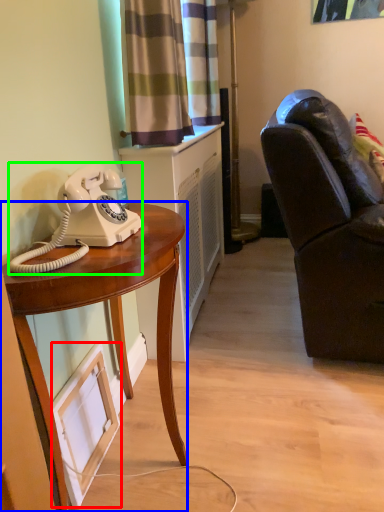
Question: Based on their relative distances, which object is nearer to picture frame (highlighted by a red box)? Choose from desk (highlighted by a blue box) and corded phone (highlighted by a green box).

Choices:
 (A) desk
 (B) corded phone

Answer: (A)